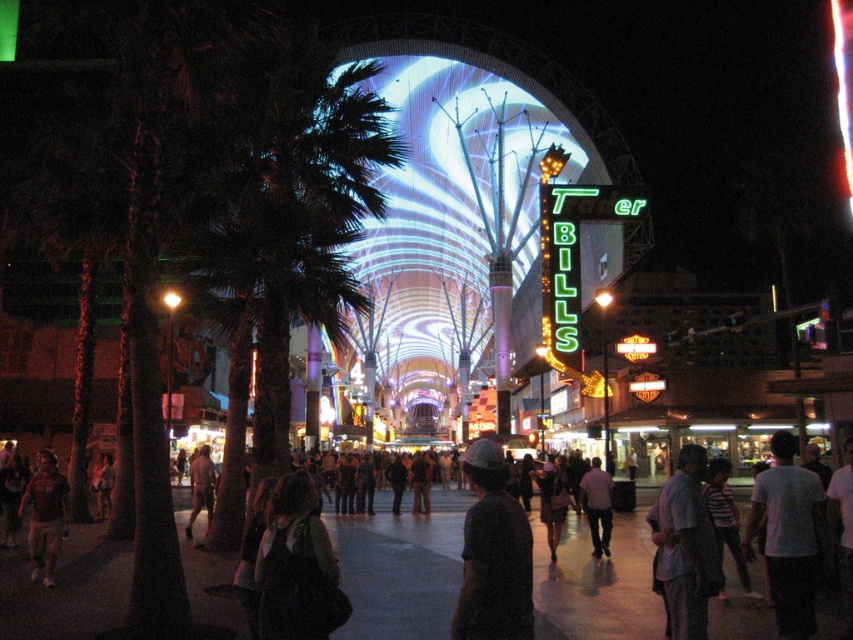
Question: From the image, what is the correct spatial relationship of dark gray shirt at lower right in relation to light purple shirt at center?

Choices:
 (A) left
 (B) right

Answer: (B)

Question: Which point is closer to the camera?

Choices:
 (A) green leafy palm tree at left
 (B) dark fabric bag at center

Answer: (B)

Question: Can you confirm if dark fabric bag at center is positioned above matte brown shirt at lower left?

Choices:
 (A) no
 (B) yes

Answer: (B)

Question: Which point is farther to the camera?

Choices:
 (A) (265, 525)
 (B) (283, 88)
 (C) (792, 440)
 (D) (584, 500)

Answer: (D)

Question: Is green leafy palm tree at left positioned in front of white matte shirt at lower right?

Choices:
 (A) no
 (B) yes

Answer: (A)

Question: Which object is closer to the camera taking this photo?

Choices:
 (A) matte brown shirt at lower left
 (B) skinny nude man at lower left
 (C) dark gray shirt at center

Answer: (C)